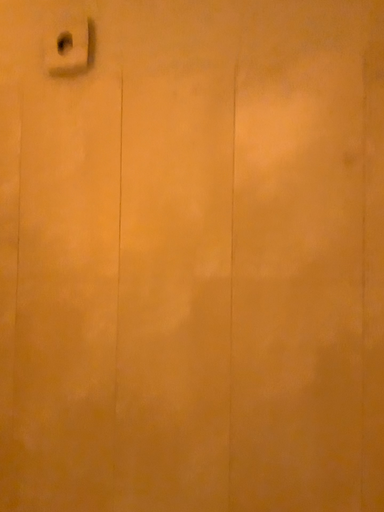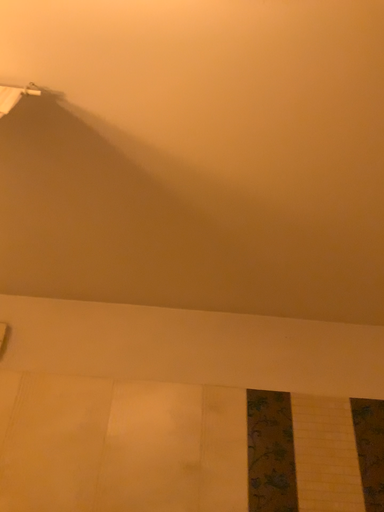
Question: How did the camera likely rotate when shooting the video?

Choices:
 (A) rotated upward
 (B) rotated downward

Answer: (A)